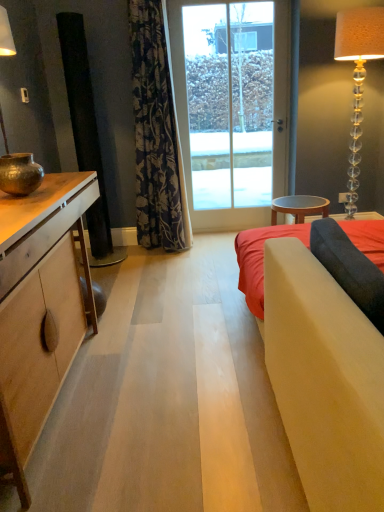
Question: Is wooden stool at center to the left of transparent glass door at center from the viewer's perspective?

Choices:
 (A) yes
 (B) no

Answer: (B)

Question: Is wooden stool at center behind transparent glass door at center?

Choices:
 (A) no
 (B) yes

Answer: (A)

Question: Can you confirm if wooden stool at center is bigger than transparent glass door at center?

Choices:
 (A) no
 (B) yes

Answer: (A)

Question: Is wooden stool at center far from transparent glass door at center?

Choices:
 (A) no
 (B) yes

Answer: (A)

Question: Does wooden stool at center have a greater height compared to transparent glass door at center?

Choices:
 (A) no
 (B) yes

Answer: (A)

Question: Is wooden stool at center surrounding transparent glass door at center?

Choices:
 (A) no
 (B) yes

Answer: (A)

Question: Is wooden stool at center at the right side of clear glass floor lamp at right?

Choices:
 (A) yes
 (B) no

Answer: (B)

Question: Is wooden stool at center thinner than clear glass floor lamp at right?

Choices:
 (A) yes
 (B) no

Answer: (B)

Question: From a real-world perspective, is wooden stool at center located beneath clear glass floor lamp at right?

Choices:
 (A) yes
 (B) no

Answer: (A)

Question: Is wooden stool at center smaller than clear glass floor lamp at right?

Choices:
 (A) yes
 (B) no

Answer: (A)

Question: From the image's perspective, is wooden stool at center on clear glass floor lamp at right?

Choices:
 (A) yes
 (B) no

Answer: (B)

Question: Is wooden stool at center located outside clear glass floor lamp at right?

Choices:
 (A) yes
 (B) no

Answer: (A)

Question: Is dark floral fabric curtain at center at the right side of matte wood cabinet at left?

Choices:
 (A) no
 (B) yes

Answer: (B)